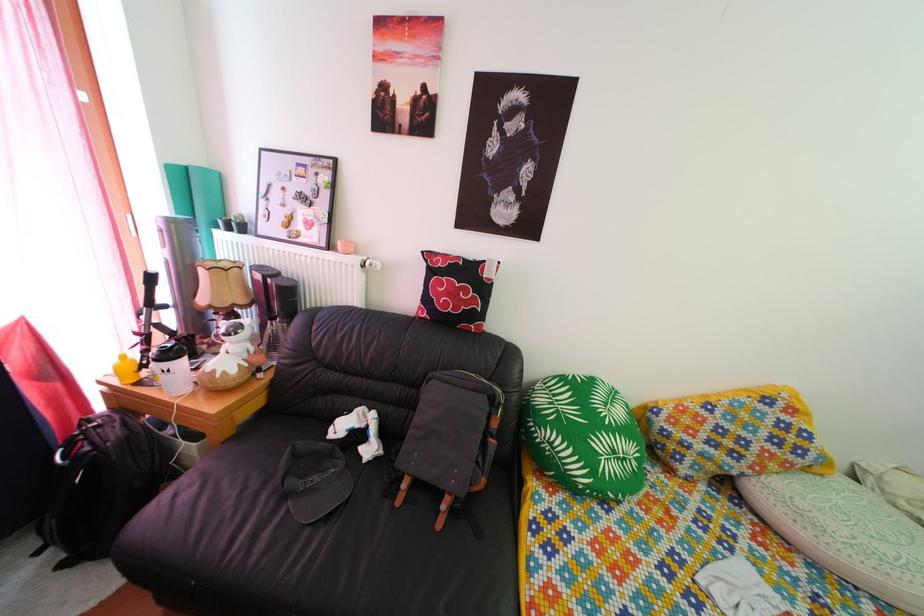
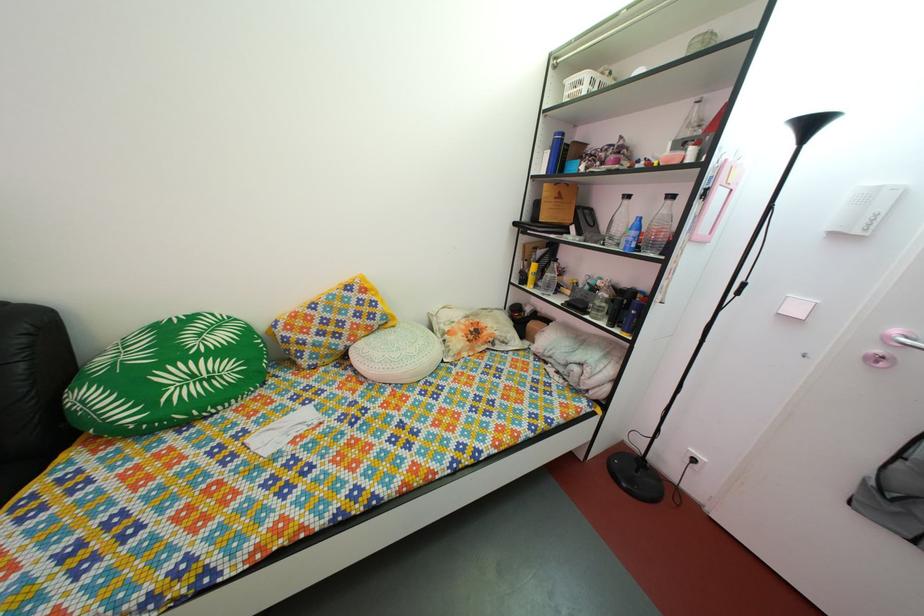
In the second image, find the point that corresponds to (634,468) in the first image.

(220, 387)